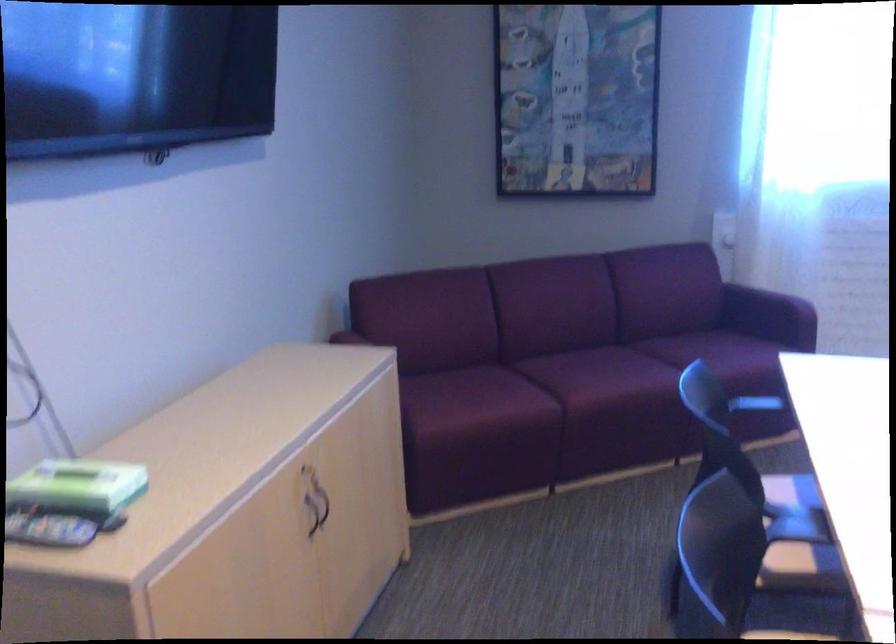
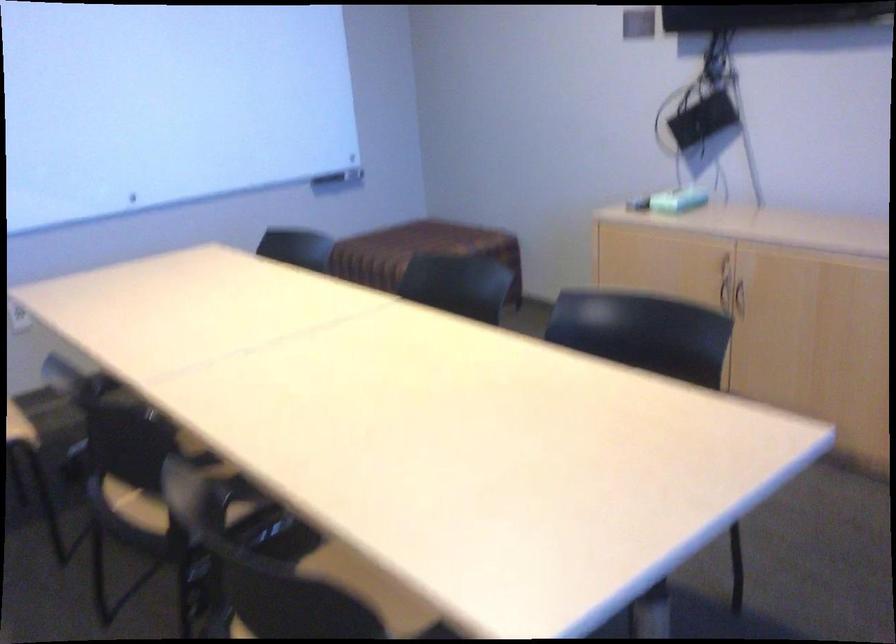
In the second image, find the point that corresponds to point 291,538 in the first image.

(725, 295)